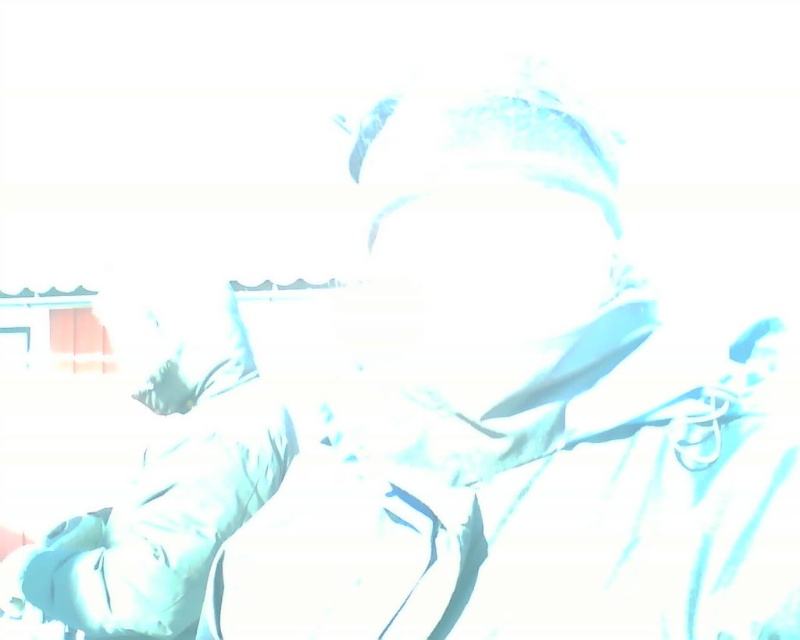
In the scene shown: Can you confirm if white fabric at center is positioned to the left of matte white shirt at lower left?

Incorrect, white fabric at center is not on the left side of matte white shirt at lower left.

Who is higher up, white fabric at center or matte white shirt at lower left?

white fabric at center is above.

Who is more distant from viewer, (425,259) or (212,483)?

Positioned behind is point (212,483).

You are a GUI agent. You are given a task and a screenshot of the screen. Output one action in this format:
    pyautogui.click(x=<x>, y=<y>)
    Task: Click on the white fabric at center
    This screenshot has height=640, width=800.
    Given the screenshot: What is the action you would take?
    pyautogui.click(x=501, y=412)